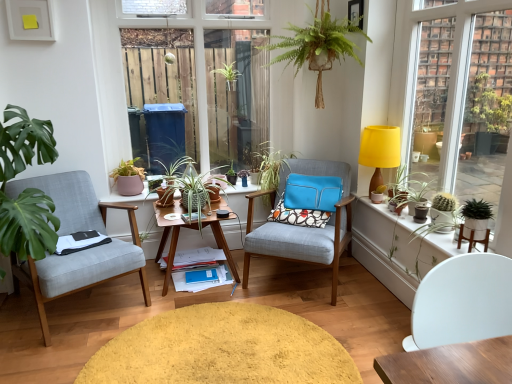
This screenshot has height=384, width=512. What do you see at coordinates (193, 229) in the screenshot?
I see `wooden desk at center` at bounding box center [193, 229].

Looking at this image, in order to face green matte flowerpot at right, placed as the second flowerpot when sorted from front to back, should I rotate leftwards or rightwards?

A 15.905 degree turn to the right will do.

What do you see at coordinates (213, 192) in the screenshot?
I see `matte brown flowerpot at center, arranged as the fourth flowerpot when viewed from the front` at bounding box center [213, 192].

Image resolution: width=512 pixels, height=384 pixels. What do you see at coordinates (165, 196) in the screenshot?
I see `matte ceramic pot at center, the 2th flowerpot when ordered from back to front` at bounding box center [165, 196].

At what (x,y) coordinates should I click in order to perform the action: click on matte ceramic pot at center, the 1th flowerpot when ordered from left to right. Please return your answer as a coordinate pair (x, y). The image size is (512, 384). Looking at the image, I should click on (165, 196).

Image resolution: width=512 pixels, height=384 pixels. Find the location of `patterned fabric pillow at center`. patterned fabric pillow at center is located at coordinates (298, 216).

Locate an element on the screen. The height and width of the screenshot is (384, 512). wooden desk at center is located at coordinates (193, 229).

Consider the image. Is yellow fabric lampshade at right oriented towards matte black pot at right, positioned as the 4th flowerpot in left-to-right order?

Yes, yellow fabric lampshade at right is aimed at matte black pot at right, positioned as the 4th flowerpot in left-to-right order.

Locate an element on the screen. The image size is (512, 384). window above the matte black pot at right, the fourth flowerpot positioned from the back (from the image's perspective) is located at coordinates click(x=448, y=75).

How different are the orientations of yellow fabric lampshade at right and matte black pot at right, the 1th flowerpot viewed from the right, in degrees?

There is a 3.05-degree angle between the facing directions of yellow fabric lampshade at right and matte black pot at right, the 1th flowerpot viewed from the right.

Is point (457, 164) positioned after point (424, 199)?

No, it is not.

From the image's perspective, which is above, matte black coffee cup at center or yellow fabric lampshade at upper right?

yellow fabric lampshade at upper right.

Does point (220, 213) appear closer or farther from the camera than point (391, 144)?

Point (220, 213) is positioned farther from the camera compared to point (391, 144).

I want to click on coffee cup below the yellow fabric lampshade at upper right (from the image's perspective), so click(222, 213).

From the picture: How many degrees apart are the facing directions of matte black coffee cup at center and yellow fabric lampshade at upper right?

The angle between the facing direction of matte black coffee cup at center and the facing direction of yellow fabric lampshade at upper right is 93.5 degrees.

Is patterned fabric pillow at center closer to camera compared to white matte chair at lower right, arranged as the 1th chair when viewed from the right?

That is False.

Is patterned fabric pillow at center wider or thinner than white matte chair at lower right, arranged as the 1th chair when viewed from the right?

Considering their sizes, patterned fabric pillow at center looks slimmer than white matte chair at lower right, arranged as the 1th chair when viewed from the right.

Considering the sizes of objects patterned fabric pillow at center and white matte chair at lower right, which is the third chair from left to right, in the image provided, who is taller, patterned fabric pillow at center or white matte chair at lower right, which is the third chair from left to right,?

Standing taller between the two is white matte chair at lower right, which is the third chair from left to right.

Is matte black pot at right, the fourth flowerpot positioned from the back, touching matte ceramic pot at center, the 1th flowerpot when ordered from left to right?

They are not placed beside each other.

Is point (415, 201) less distant than point (166, 206)?

Yes, point (415, 201) is closer to viewer.

Between matte black pot at right, which is counted as the first flowerpot, starting from the front, and matte ceramic pot at center, which is the third flowerpot in front-to-back order, which one has larger width?

matte ceramic pot at center, which is the third flowerpot in front-to-back order.

From a real-world perspective, between matte black pot at right, positioned as the 4th flowerpot in left-to-right order, and matte ceramic pot at center, the fourth flowerpot viewed from the right, who is vertically higher?

From a 3D spatial view, matte black pot at right, positioned as the 4th flowerpot in left-to-right order, is above.

Considering the sizes of objects yellow plush rug at center and wooden desk at center in the image provided, who is smaller, yellow plush rug at center or wooden desk at center?

With smaller size is yellow plush rug at center.

From a real-world perspective, between yellow plush rug at center and wooden desk at center, who is vertically higher?

From a 3D spatial view, wooden desk at center is above.

Does pink ceramic pot at left, marked as the first houseplant in a left-to-right arrangement, appear on the right side of matte black pot at right, positioned as the 4th flowerpot in left-to-right order?

In fact, pink ceramic pot at left, marked as the first houseplant in a left-to-right arrangement, is to the left of matte black pot at right, positioned as the 4th flowerpot in left-to-right order.

Between pink ceramic pot at left, the fifth houseplant from the right, and matte black pot at right, which is counted as the first flowerpot, starting from the front, which one has smaller size?

matte black pot at right, which is counted as the first flowerpot, starting from the front, is smaller.

Does pink ceramic pot at left, marked as the first houseplant in a left-to-right arrangement, have a greater width compared to matte black pot at right, which is counted as the first flowerpot, starting from the front?

Correct, the width of pink ceramic pot at left, marked as the first houseplant in a left-to-right arrangement, exceeds that of matte black pot at right, which is counted as the first flowerpot, starting from the front.

Is point (138, 177) positioned in front of point (413, 215)?

No, it is behind (413, 215).

In the scene shown: Is white matte chair at lower right, which is the third chair from left to right, positioned before matte black pot at right, the fourth flowerpot positioned from the back?

Yes, the depth of white matte chair at lower right, which is the third chair from left to right, is less than that of matte black pot at right, the fourth flowerpot positioned from the back.

How far apart are white matte chair at lower right, which is the third chair from left to right, and matte black pot at right, the fourth flowerpot positioned from the back?

white matte chair at lower right, which is the third chair from left to right, is 4.45 feet from matte black pot at right, the fourth flowerpot positioned from the back.

In the scene shown: Who is smaller, white matte chair at lower right, arranged as the 1th chair when viewed from the right, or matte black pot at right, the fourth flowerpot positioned from the back?

Smaller between the two is matte black pot at right, the fourth flowerpot positioned from the back.

The height and width of the screenshot is (384, 512). Find the location of `the 1st flowerpot positioned below the yellow fabric lampshade at right (from a real-world perspective)`. the 1st flowerpot positioned below the yellow fabric lampshade at right (from a real-world perspective) is located at coordinates (416, 205).

This screenshot has width=512, height=384. I want to click on table lamp located above the matte black coffee cup at center (from a real-world perspective), so click(379, 151).

Considering their positions, is white matte chair at lower right, the first chair when ordered from front to back, positioned closer to yellow fabric lampshade at upper right than green matte flowerpot at right, the 3th flowerpot from the left?

green matte flowerpot at right, the 3th flowerpot from the left.

Considering their positions, is wooden desk at center positioned closer to yellow plush rug at center than green glossy plant at center, acting as the fourth houseplant starting from the right?

wooden desk at center.

Looking at this image, from the image, which object appears to be nearer to wooden desk at center, light gray fabric chair at left, which is the 1th chair from left to right, or matte ceramic pot at center, which is the third flowerpot in front-to-back order?

matte ceramic pot at center, which is the third flowerpot in front-to-back order, lies closer to wooden desk at center than the other object.

Based on their spatial positions, is matte brown flowerpot at center, the 2th flowerpot in the left-to-right sequence, or textured fabric armchair at center, the third chair viewed from the front, further from pink ceramic pot at left, marked as the first houseplant in a left-to-right arrangement?

textured fabric armchair at center, the third chair viewed from the front.

When comparing their distances from yellow fabric lampshade at upper right, does green matte plant at right, which is counted as the 1th houseplant, starting from the right, or light gray fabric chair at left, which is counted as the third chair, starting from the right, seem further?

light gray fabric chair at left, which is counted as the third chair, starting from the right, lies further to yellow fabric lampshade at upper right than the other object.

Looking at the image, which one is located closer to matte black coffee cup at center, green leafy plant at center, the third houseplant in the right-to-left sequence, or textured fabric armchair at center, the third chair viewed from the front?

green leafy plant at center, the third houseplant in the right-to-left sequence, lies closer to matte black coffee cup at center than the other object.

Looking at this image, based on their spatial positions, is textured fabric armchair at center, which ranks as the 1th chair in back-to-front order, or green leafy plant at center, the third houseplant from the left, closer to green matte flowerpot at right, placed as the second flowerpot when sorted from front to back?

textured fabric armchair at center, which ranks as the 1th chair in back-to-front order, lies closer to green matte flowerpot at right, placed as the second flowerpot when sorted from front to back, than the other object.

Looking at the image, which one is located further to yellow fabric lampshade at upper right, matte brown flowerpot at center, positioned as the 3th flowerpot in right-to-left order, or green leafy plant at center, the third houseplant in the right-to-left sequence?

matte brown flowerpot at center, positioned as the 3th flowerpot in right-to-left order, lies further to yellow fabric lampshade at upper right than the other object.

You are a GUI agent. You are given a task and a screenshot of the screen. Output one action in this format:
    pyautogui.click(x=<x>, y=<y>)
    Task: Click on the bay window between light gray fabric chair at left, positioned as the second chair in front-to-back order, and green woven basket at upper center, placed as the 4th houseplant when sorted from left to right
    
    Given the screenshot: What is the action you would take?
    pyautogui.click(x=203, y=71)

Locate an element on the screen. This screenshot has width=512, height=384. desk between green woven basket at upper center, which appears as the second houseplant when viewed from the right, and yellow plush rug at center, in the vertical direction is located at coordinates (193, 229).

At what (x,y) coordinates should I click in order to perform the action: click on wide between yellow fabric lampshade at right and matte brown flowerpot at center, positioned as the 3th flowerpot in right-to-left order, along the z-axis. Please return your answer as a coordinate pair (x, y). The width and height of the screenshot is (512, 384). Looking at the image, I should click on (222, 349).

This screenshot has width=512, height=384. What are the coordinates of `pillow between green woven basket at upper center, placed as the 4th houseplant when sorted from left to right, and green matte cactus at right, in the vertical direction` in the screenshot? It's located at (298, 216).